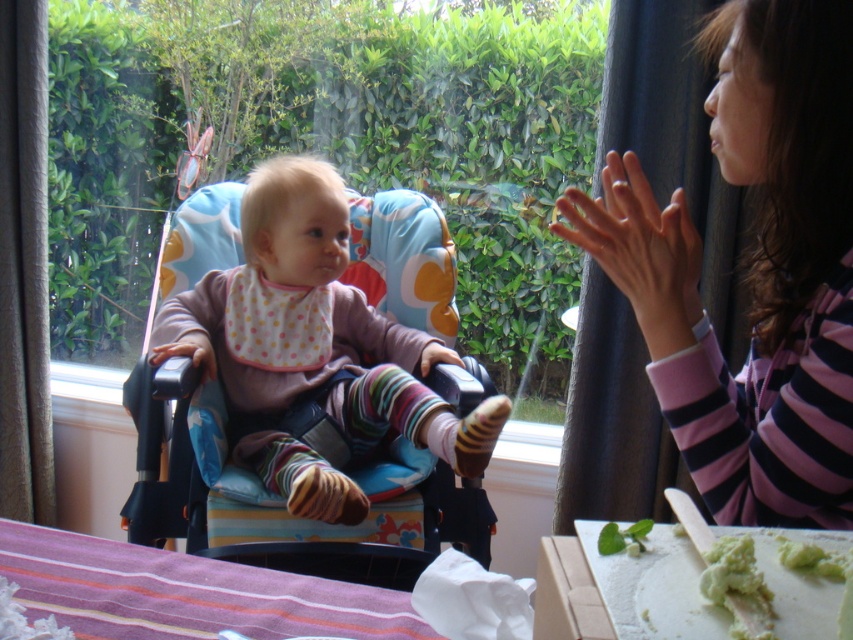
Which is in front, point (628, 268) or point (843, 561)?

Point (843, 561)

Does smooth skin hands at upper right appear on the left side of green creamy food at lower right?

Correct, you'll find smooth skin hands at upper right to the left of green creamy food at lower right.

Does point (650, 324) come closer to viewer compared to point (814, 556)?

No, it is not.

Identify the location of smooth skin hands at upper right. (639, 250).

Measure the distance from white plastic cutting board at lower right to smooth skin hands at upper right.

white plastic cutting board at lower right and smooth skin hands at upper right are 35.17 centimeters apart.

Identify the location of white plastic cutting board at lower right. (622, 589).

At what (x,y) coordinates should I click in order to perform the action: click on white plastic cutting board at lower right. Please return your answer as a coordinate pair (x, y). This screenshot has width=853, height=640. Looking at the image, I should click on (622, 589).

Does point (802, 253) come behind point (596, 256)?

Yes.

Which is in front, point (766, 522) or point (596, 218)?

Point (766, 522)

Is point (846, 483) closer to camera compared to point (643, 321)?

Yes, point (846, 483) is closer to viewer.

Locate an element on the screen. The width and height of the screenshot is (853, 640). striped fabric shirt at right is located at coordinates (749, 282).